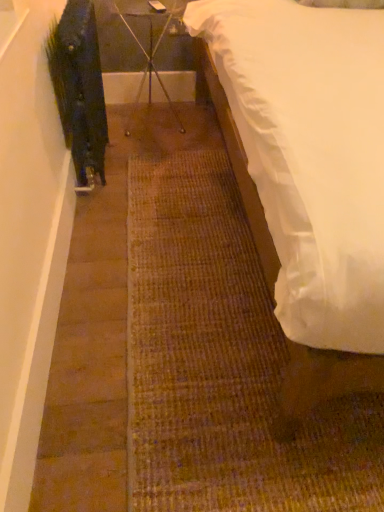
Question: Is white satin bed at right positioned in front of metal tripod at center?

Choices:
 (A) no
 (B) yes

Answer: (B)

Question: From the image's perspective, is white satin bed at right located beneath metal tripod at center?

Choices:
 (A) yes
 (B) no

Answer: (A)

Question: Can you confirm if white satin bed at right is thinner than metal tripod at center?

Choices:
 (A) yes
 (B) no

Answer: (B)

Question: Is white satin bed at right facing towards metal tripod at center?

Choices:
 (A) yes
 (B) no

Answer: (B)

Question: Would you say white satin bed at right is outside metal tripod at center?

Choices:
 (A) no
 (B) yes

Answer: (B)

Question: Would you say white satin bed at right is a long distance from metal tripod at center?

Choices:
 (A) no
 (B) yes

Answer: (B)

Question: Is metal tripod at center oriented towards white satin bed at right?

Choices:
 (A) yes
 (B) no

Answer: (B)

Question: From a real-world perspective, is metal tripod at center located higher than white satin bed at right?

Choices:
 (A) yes
 (B) no

Answer: (B)

Question: Does metal tripod at center have a lesser width compared to white satin bed at right?

Choices:
 (A) yes
 (B) no

Answer: (A)

Question: Can you confirm if metal tripod at center is shorter than white satin bed at right?

Choices:
 (A) yes
 (B) no

Answer: (A)

Question: Is white satin bed at right completely or partially inside metal tripod at center?

Choices:
 (A) yes
 (B) no

Answer: (B)

Question: Can we say metal tripod at center lies outside white satin bed at right?

Choices:
 (A) yes
 (B) no

Answer: (A)

Question: Is metal tripod at center bigger than green matte plant at left?

Choices:
 (A) no
 (B) yes

Answer: (B)